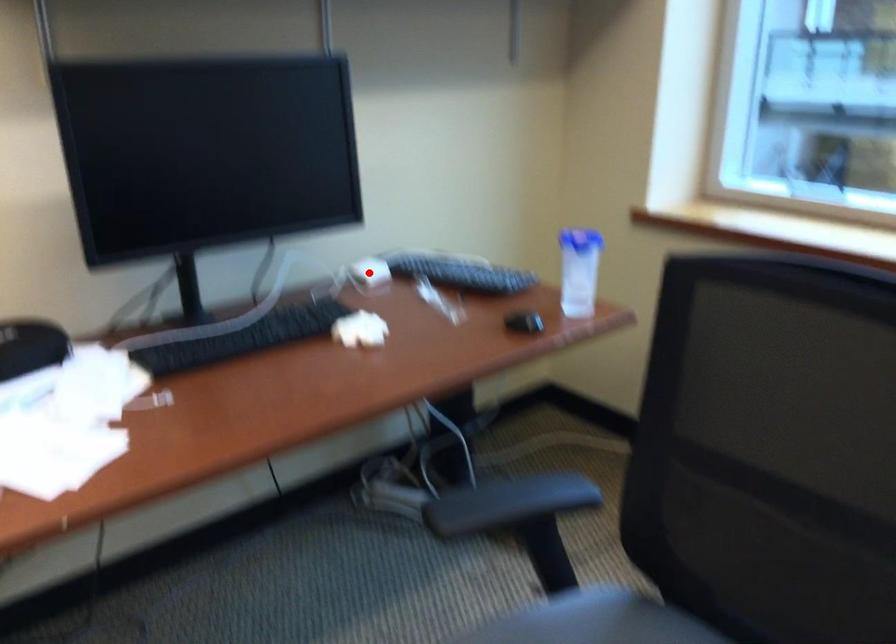
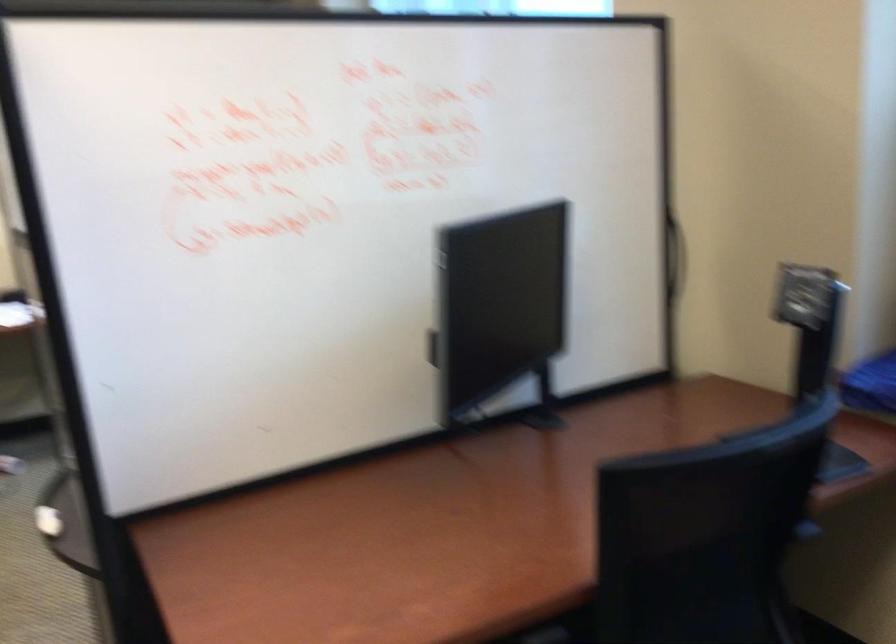
Question: I am providing you with two images of the same scene from different viewpoints. A red point is marked on the first image. Can you still see the location of the red point in image 2?

Choices:
 (A) Yes
 (B) No

Answer: (B)